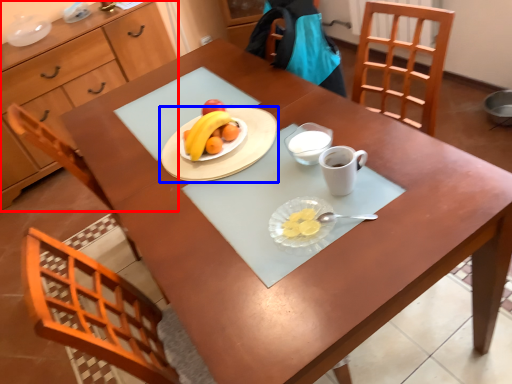
Question: Which point is closer to the camera, cabinetry (highlighted by a red box) or tableware (highlighted by a blue box)?

Choices:
 (A) cabinetry
 (B) tableware

Answer: (B)